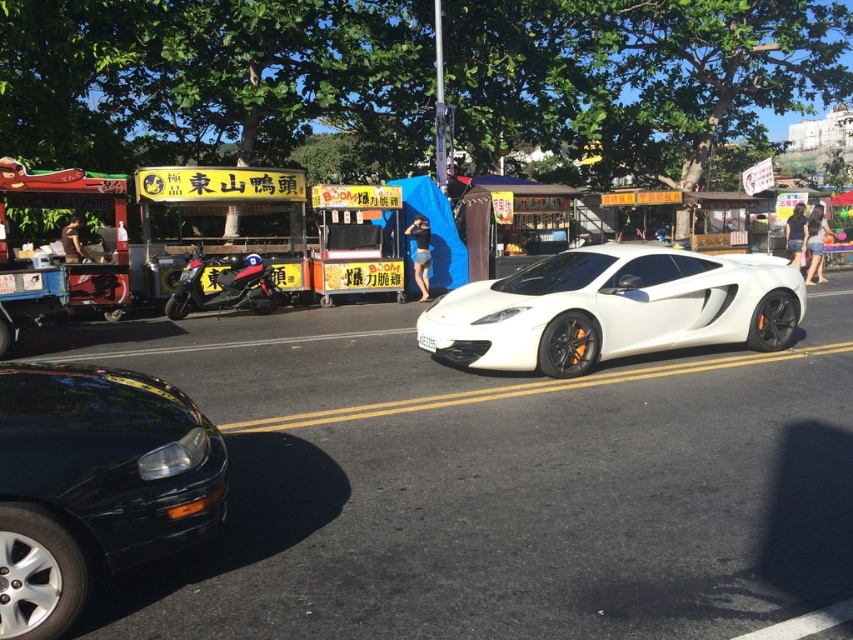
You are a delivery driver who needs to park your vehicle between the glossy black sedan at lower left and the white plastic license plate at center. Your vehicle is 15 feet long. Can you fit your vehicle in that space?

The distance between the glossy black sedan at lower left and the white plastic license plate at center is 16.25 feet. Since your vehicle is 15 feet long, it can fit in the space as there is enough room.

You are a delivery person who needs to park your bike between the glossy black sedan at lower left and the white glossy sports car at center. The bike requires 3 meters of space. Is there enough space between them?

The glossy black sedan at lower left is 5.22 meters from the white glossy sports car at center, so yes, there is enough space to park the bike between them since 5.22 meters exceeds the required 3 meters.